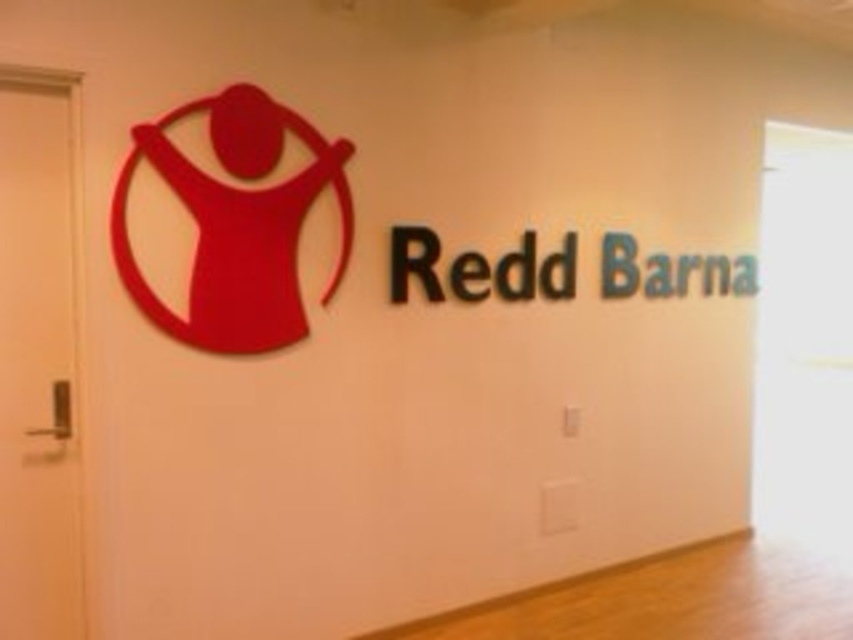
Can you confirm if black matte sign at upper center is positioned below green matte barna at upper right?

Correct, black matte sign at upper center is located below green matte barna at upper right.

What do you see at coordinates (496, 273) in the screenshot? Image resolution: width=853 pixels, height=640 pixels. I see `black matte sign at upper center` at bounding box center [496, 273].

Locate an element on the screen. Image resolution: width=853 pixels, height=640 pixels. black matte sign at upper center is located at coordinates (496, 273).

Is matte red logo at upper left positioned at the back of black matte sign at upper center?

That is False.

Can you confirm if matte red logo at upper left is bigger than black matte sign at upper center?

Yes, matte red logo at upper left is bigger than black matte sign at upper center.

Measure the distance between matte red logo at upper left and camera.

The distance of matte red logo at upper left from camera is 2.71 meters.

Identify the location of matte red logo at upper left. (236, 221).

Does matte red logo at upper left appear over green matte barna at upper right?

Incorrect, matte red logo at upper left is not positioned above green matte barna at upper right.

Is matte red logo at upper left thinner than green matte barna at upper right?

Yes.

Locate an element on the screen. matte red logo at upper left is located at coordinates click(236, 221).

At what (x,y) coordinates should I click in order to perform the action: click on matte red logo at upper left. Please return your answer as a coordinate pair (x, y). The height and width of the screenshot is (640, 853). Looking at the image, I should click on (236, 221).